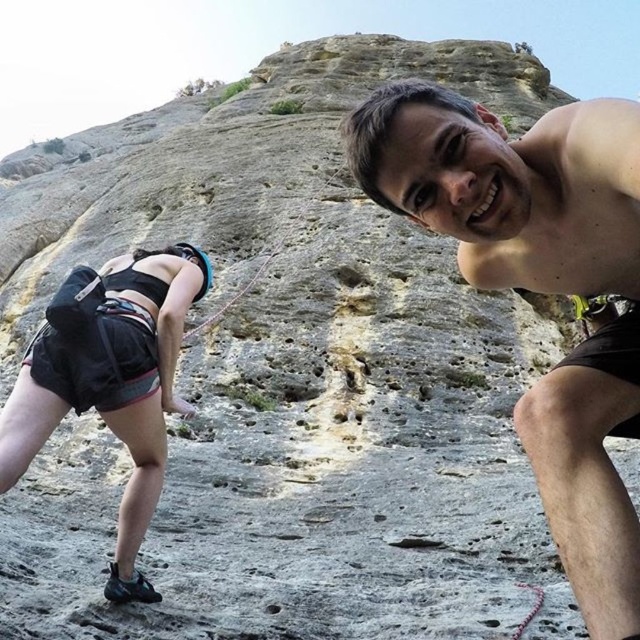
You are a photographer taking a picture of the rock climbing scene. You notice a point at coordinates (109, 380). What object is located at that point?

The point at coordinates (109, 380) has the black fabric shorts at lower left.